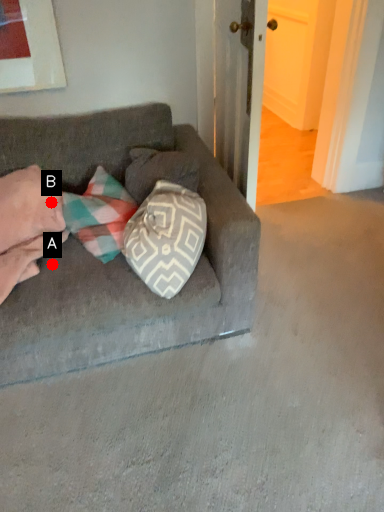
Question: Two points are circled on the image, labeled by A and B beside each circle. Which point is closer to the camera?

Choices:
 (A) A is closer
 (B) B is closer

Answer: (A)